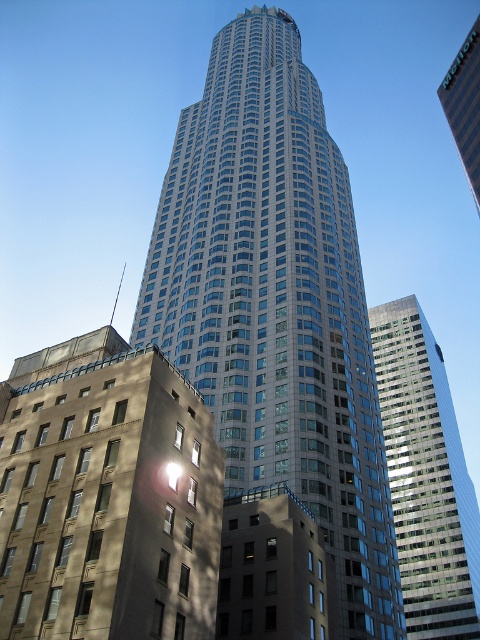
Between point (206, 593) and point (445, 547), which one is positioned in front?

Positioned in front is point (206, 593).

Can you confirm if beige concrete building at lower left is smaller than glassy reflective skyscraper at right?

Yes.

Describe the element at coordinates (107, 497) in the screenshot. The height and width of the screenshot is (640, 480). I see `beige concrete building at lower left` at that location.

This screenshot has width=480, height=640. Find the location of `beige concrete building at lower left`. beige concrete building at lower left is located at coordinates (107, 497).

Is the position of glassy silver skyscraper at center less distant than that of beige concrete building at lower left?

No, glassy silver skyscraper at center is further to the viewer.

Between point (214, 138) and point (182, 538), which one is positioned behind?

The point (214, 138) is behind.

Looking at this image, who is more distant from viewer, (374, 387) or (96, 577)?

The point (374, 387) is behind.

Locate an element on the screen. glassy silver skyscraper at center is located at coordinates (276, 305).

I want to click on glassy silver skyscraper at center, so click(x=276, y=305).

Does glassy silver skyscraper at center appear under glassy steel skyscraper at center?

Yes.

Between point (316, 289) and point (475, 115), which one is positioned in front?

Positioned in front is point (316, 289).

This screenshot has width=480, height=640. I want to click on glassy silver skyscraper at center, so [276, 305].